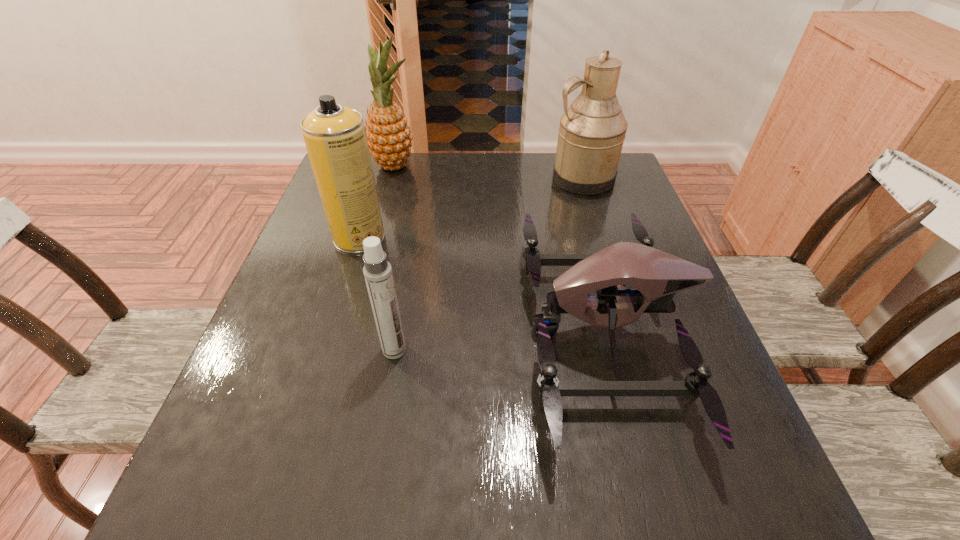
Where is `pineapple`? pineapple is located at coordinates (388, 135).

In order to click on pitcher in this screenshot , I will do pos(592,130).

Locate an element on the screen. the taller aerosol can is located at coordinates (335, 137).

Locate an element on the screen. Image resolution: width=960 pixels, height=540 pixels. the farther aerosol can is located at coordinates (335, 137).

This screenshot has width=960, height=540. I want to click on the right aerosol can, so click(377, 271).

At what (x,y) coordinates should I click in order to perform the action: click on the shorter aerosol can. Please return your answer as a coordinate pair (x, y). Looking at the image, I should click on (377, 271).

You are a GUI agent. You are given a task and a screenshot of the screen. Output one action in this format:
    pyautogui.click(x=<x>, y=<y>)
    Task: Click on the drone
    The image size is (960, 540).
    Given the screenshot: What is the action you would take?
    pyautogui.click(x=656, y=276)

I want to click on vacant space situated 0.170m on the front of the pineapple, so click(381, 214).

Identify the location of vacant area situated on the front of the pitcher. This screenshot has width=960, height=540. (615, 287).

The height and width of the screenshot is (540, 960). I want to click on free region located on the front of the taller aerosol can, so click(x=348, y=275).